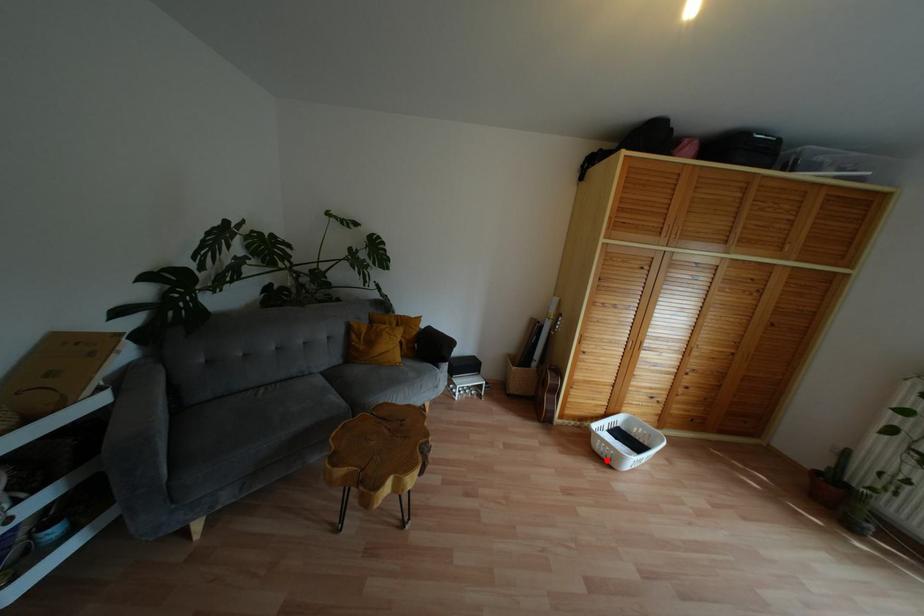
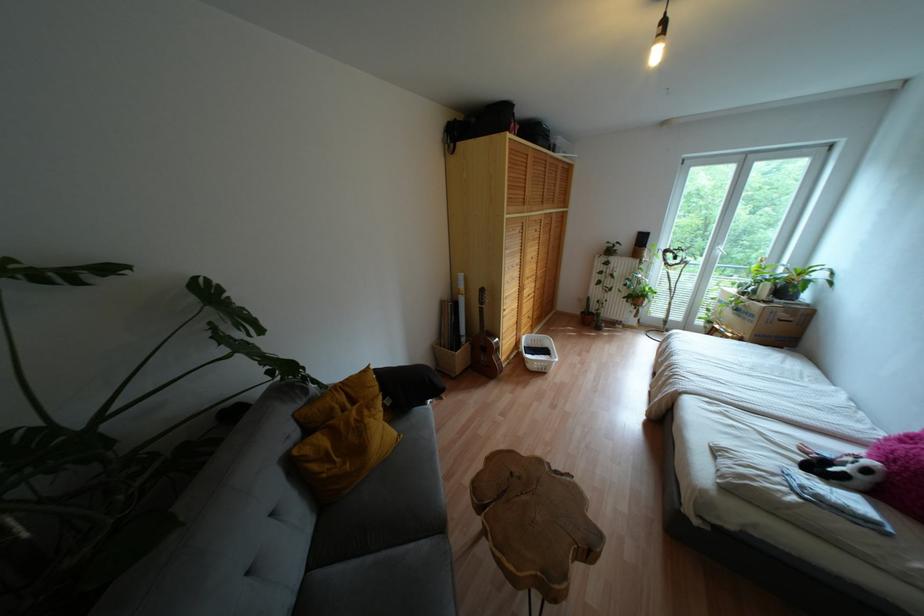
Question: I am providing you with two images of the same scene from different viewpoints. A red point is shown in image1. For the corresponding object point in image2, is it positioned nearer or farther from the camera?

Choices:
 (A) Nearer
 (B) Farther

Answer: (A)